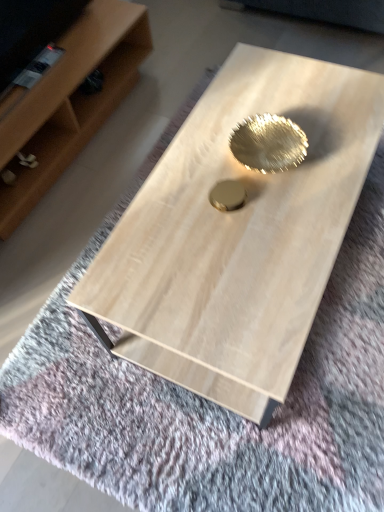
The image size is (384, 512). In order to click on free location to the right of light wood shelf at upper left in this screenshot , I will do `click(156, 104)`.